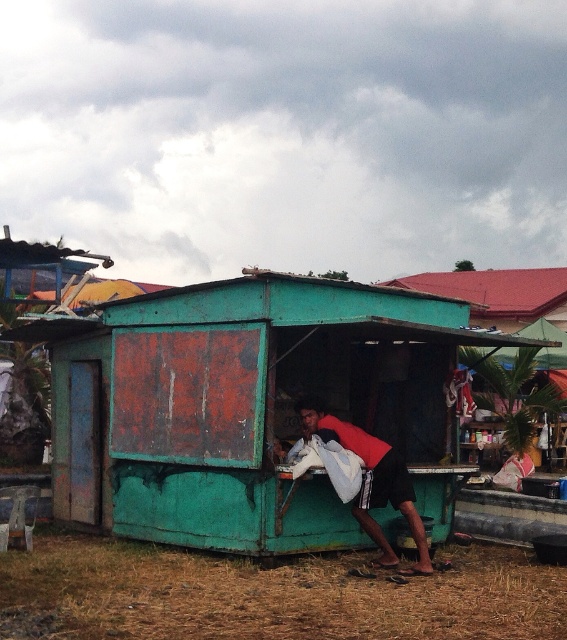
Question: Which point appears closest to the camera in this image?

Choices:
 (A) (430, 378)
 (B) (310, 397)

Answer: (B)

Question: Does rusty metal shack at center appear under orange fabric shirt at center?

Choices:
 (A) no
 (B) yes

Answer: (A)

Question: Is the position of rusty metal shack at center more distant than that of orange fabric shirt at center?

Choices:
 (A) yes
 (B) no

Answer: (B)

Question: Among these points, which one is nearest to the camera?

Choices:
 (A) (437, 504)
 (B) (366, 493)

Answer: (B)

Question: Can you confirm if rusty metal shack at center is thinner than orange fabric shirt at center?

Choices:
 (A) no
 (B) yes

Answer: (A)